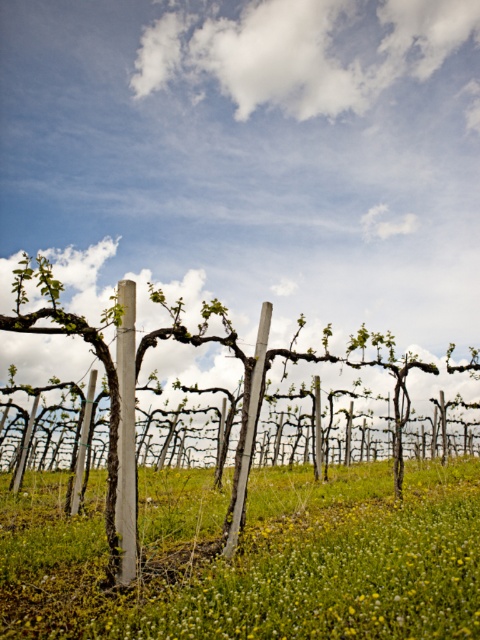
Is point (81, 435) closer to camera compared to point (238, 529)?

No, it is behind (238, 529).

Which of these two, green wood vine at center or smooth gray pole at center, stands taller?

With more height is smooth gray pole at center.

Describe the element at coordinates (97, 356) in the screenshot. The height and width of the screenshot is (640, 480). I see `green wood vine at center` at that location.

This screenshot has width=480, height=640. I want to click on green wood vine at center, so [x=97, y=356].

Is green wood vine at center further to camera compared to wooden posts at center?

No, green wood vine at center is closer to the viewer.

Who is more distant from viewer, (41,275) or (219,465)?

The point (219,465) is more distant.

You are a GUI agent. You are given a task and a screenshot of the screen. Output one action in this format:
    pyautogui.click(x=<x>, y=<y>)
    Task: Click on the green wood vine at center
    
    Given the screenshot: What is the action you would take?
    pyautogui.click(x=97, y=356)

Between wooden posts at center and smooth gray pole at center, which one has more height?

wooden posts at center

Is point (84, 476) more distant than point (256, 410)?

Yes, it is.

Is point (162, 412) more distant than point (264, 310)?

Yes.

This screenshot has height=640, width=480. I want to click on wooden posts at center, so click(60, 387).